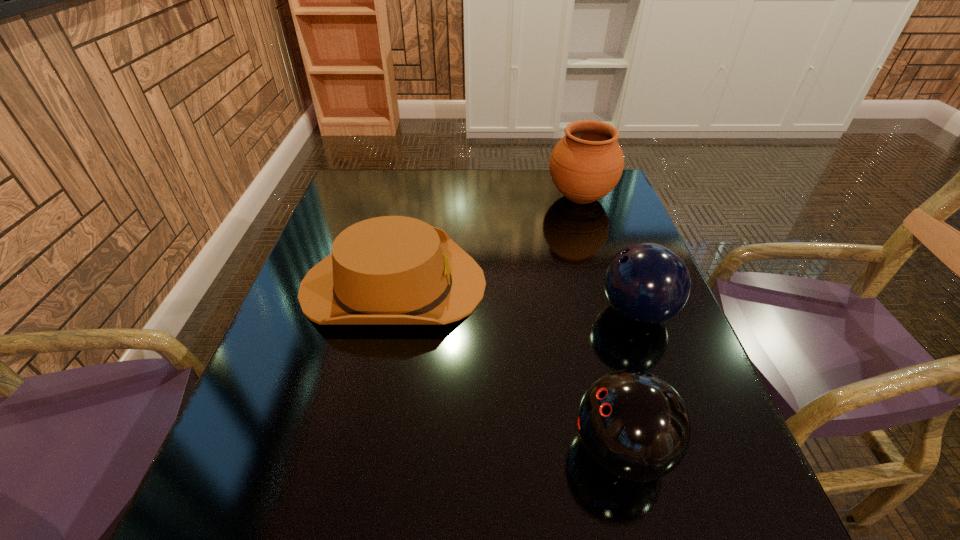
The width and height of the screenshot is (960, 540). Identify the location of vacant point at the far edge. (x=539, y=179).

Identify the location of vacant space at the near edge. The width and height of the screenshot is (960, 540). (586, 504).

The width and height of the screenshot is (960, 540). In the image, there is a desktop. Identify the location of vacant space at the left edge. (278, 487).

The height and width of the screenshot is (540, 960). Identify the location of free space at the right edge. 620,230.

In the image, there is a desktop. Where is `vacant space at the far right corner`? This screenshot has width=960, height=540. vacant space at the far right corner is located at coordinates (x=618, y=183).

The image size is (960, 540). In order to click on vacant space that is in between the shortest object and the nearest object in this screenshot , I will do `click(508, 367)`.

In order to click on free space between the cowboy hat and the tallest object in this screenshot , I will do `click(487, 241)`.

The height and width of the screenshot is (540, 960). I want to click on free space between the leftmost object and the pottery, so click(x=487, y=241).

Where is `vacant space that's between the nearer bowling ball and the cowboy hat`? Image resolution: width=960 pixels, height=540 pixels. vacant space that's between the nearer bowling ball and the cowboy hat is located at coordinates (508, 367).

This screenshot has width=960, height=540. What are the coordinates of `free space that is in between the farther bowling ball and the shortest object` in the screenshot? It's located at (516, 298).